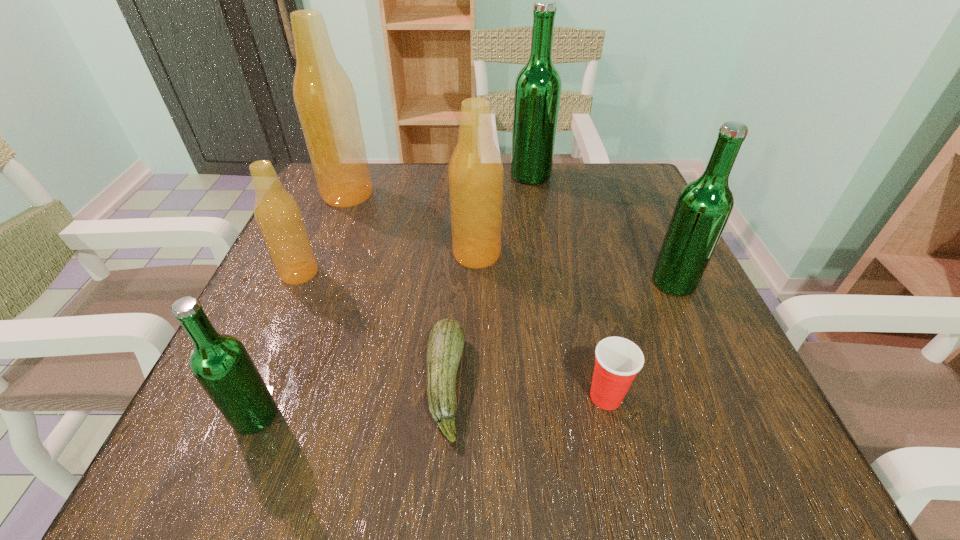
Locate an element on the screen. The image size is (960, 540). red Dixie cup is located at coordinates (618, 360).

Identify the location of Dixie cup. (x=618, y=360).

Where is `green zucchini`? green zucchini is located at coordinates (445, 344).

Where is `zucchini`? zucchini is located at coordinates (445, 344).

At what (x,y) coordinates should I click in order to perform the action: click on blank space located 0.090m on the front of the second green beer bottle from left to right. Please return your answer as a coordinate pair (x, y). Looking at the image, I should click on (536, 207).

Locate an element on the screen. free spot located on the front of the biggest tan beer bottle is located at coordinates (333, 231).

In order to click on vacant position located on the right of the third beer bottle from right to left in this screenshot , I will do `click(562, 254)`.

The image size is (960, 540). I want to click on blank area located 0.170m on the left of the rightmost green beer bottle, so click(559, 282).

Find the location of a particular element. Image resolution: width=960 pixels, height=540 pixels. free space located on the front of the smallest tan beer bottle is located at coordinates (252, 380).

Identify the location of vacant space located on the back of the nearest green beer bottle. (289, 333).